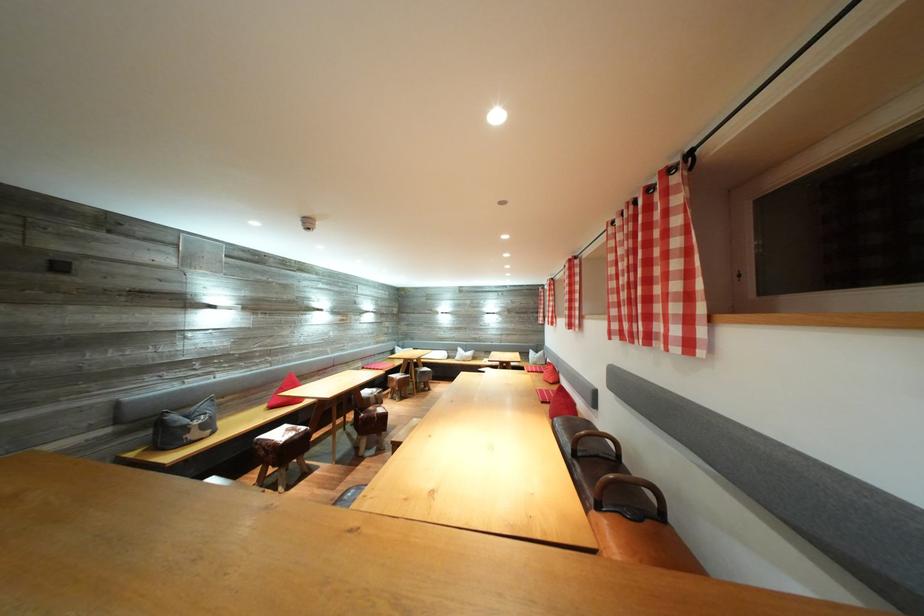
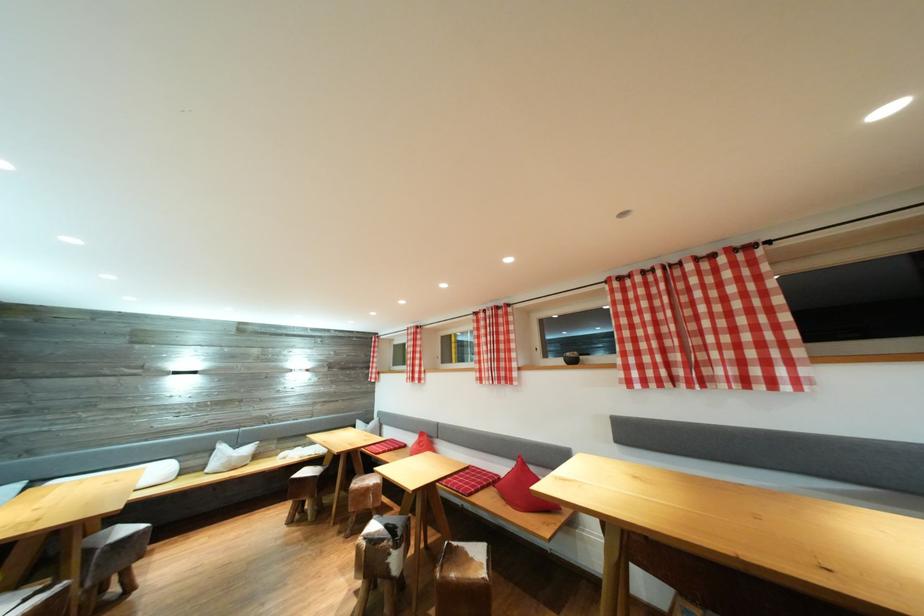
The point at (445,361) is marked in the first image. Where is the corresponding point in the second image?

(161, 483)